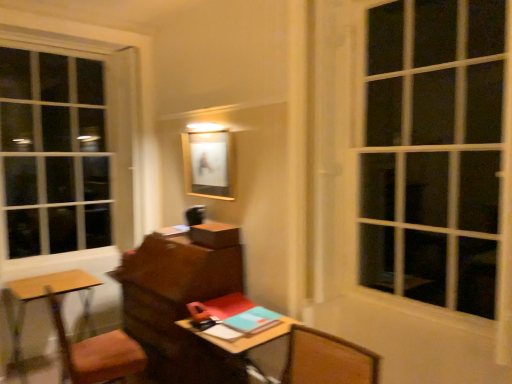
Question: Is wooden desk at center inside or outside of teal matte notebook at center?

Choices:
 (A) inside
 (B) outside

Answer: (B)

Question: From their relative heights in the image, would you say wooden desk at center is taller or shorter than teal matte notebook at center?

Choices:
 (A) tall
 (B) short

Answer: (A)

Question: Considering the real-world distances, which object is farthest from the white glass window at upper right?

Choices:
 (A) wooden desk at center
 (B) wooden table at lower left
 (C) teal matte notebook at center
 (D) matte wooden picture frame at center
 (E) wooden cushioned chair at lower left

Answer: (B)

Question: Which is nearer to the wooden table at lower left?

Choices:
 (A) white glass window at upper right
 (B) wooden desk at center
 (C) matte wooden picture frame at center
 (D) teal matte notebook at center
 (E) wooden cushioned chair at lower left

Answer: (E)